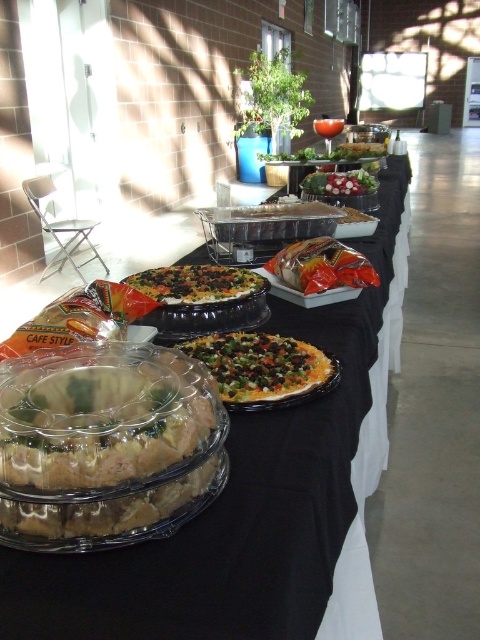
Which is more to the left, clear plastic tray at center or matte black pizza at center?

matte black pizza at center is more to the left.

In the scene shown: Can you confirm if clear plastic tray at center is bigger than matte black pizza at center?

Yes, clear plastic tray at center is bigger than matte black pizza at center.

Between point (289, 547) and point (188, 301), which one is positioned in front?

Point (289, 547) is in front.

Identify the location of clear plastic tray at center. The image size is (480, 640). (237, 506).

Consider the image. Who is lower down, vegetable-topped pizza at center or translucent plastic bag at center?

vegetable-topped pizza at center is lower down.

Is vegetable-topped pizza at center thinner than translucent plastic bag at center?

In fact, vegetable-topped pizza at center might be wider than translucent plastic bag at center.

Is point (307, 368) farther from viewer compared to point (294, 282)?

No, (307, 368) is closer to viewer.

Image resolution: width=480 pixels, height=640 pixels. Find the location of `vegetable-topped pizza at center`. vegetable-topped pizza at center is located at coordinates (262, 365).

In the scene shown: Is clear plastic cake at center taller than fresh green salad at center?

Yes, clear plastic cake at center is taller than fresh green salad at center.

Between clear plastic cake at center and fresh green salad at center, which one appears on the right side from the viewer's perspective?

From the viewer's perspective, fresh green salad at center appears more on the right side.

Who is more distant from viewer, (183, 497) or (336, 195)?

The point (336, 195) is more distant.

Locate an element on the screen. This screenshot has height=640, width=480. clear plastic cake at center is located at coordinates (106, 445).